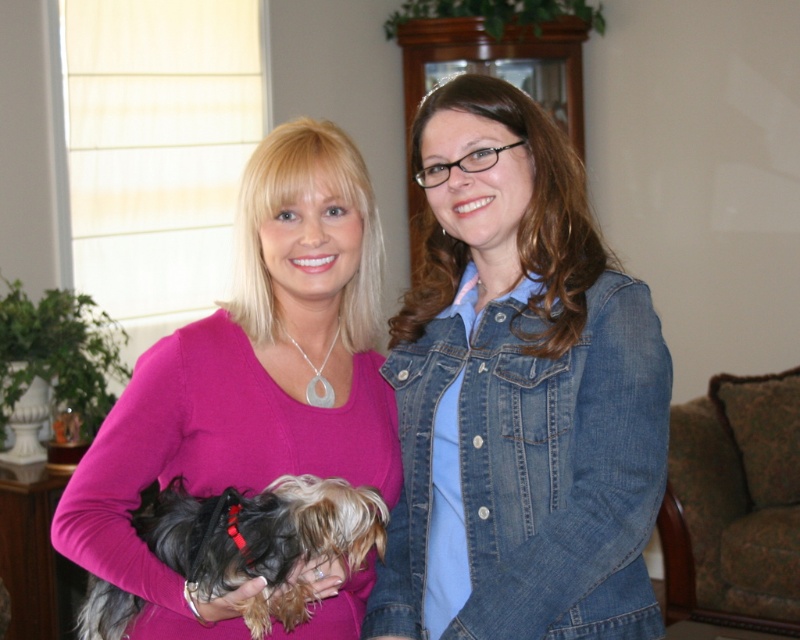
Is point (506, 566) positioned in front of point (668, 611)?

Yes, point (506, 566) is in front of point (668, 611).

Between denim jacket at center and green floral fabric armchair at lower right, which one appears on the left side from the viewer's perspective?

Positioned to the left is denim jacket at center.

Which is in front, point (512, 122) or point (760, 621)?

Point (512, 122) is in front.

Where is `denim jacket at center`? denim jacket at center is located at coordinates (518, 396).

This screenshot has height=640, width=800. I want to click on pink matte sweater at center, so click(250, 378).

Can you confirm if pink matte sweater at center is wider than fluffy brown dog at center?

Yes.

Does point (148, 570) come farther from viewer compared to point (372, 525)?

No, it is in front of (372, 525).

At what (x,y) coordinates should I click in order to perform the action: click on pink matte sweater at center. Please return your answer as a coordinate pair (x, y). Looking at the image, I should click on (250, 378).

Between denim jacket at center and pink matte sweater at center, which one has less height?

pink matte sweater at center is shorter.

Does point (550, 429) lie in front of point (324, 218)?

That is True.

You are a GUI agent. You are given a task and a screenshot of the screen. Output one action in this format:
    pyautogui.click(x=<x>, y=<y>)
    Task: Click on the denim jacket at center
    This screenshot has height=640, width=800.
    Given the screenshot: What is the action you would take?
    pyautogui.click(x=518, y=396)